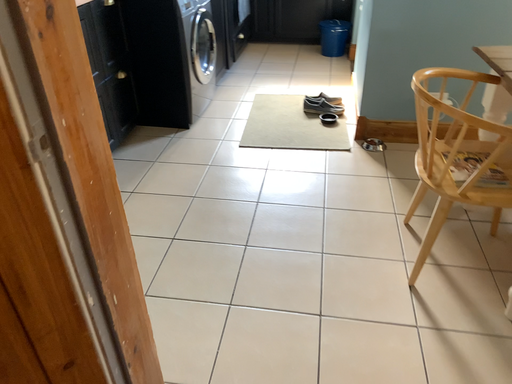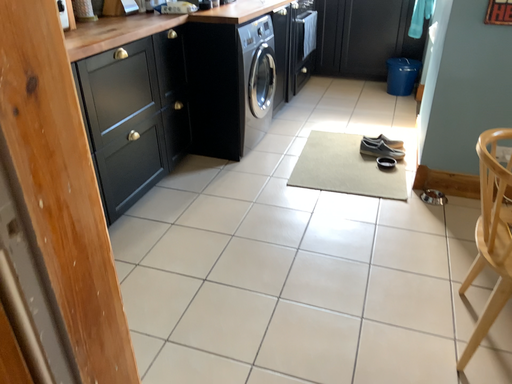
Question: How did the camera likely rotate when shooting the video?

Choices:
 (A) rotated left
 (B) rotated right

Answer: (A)